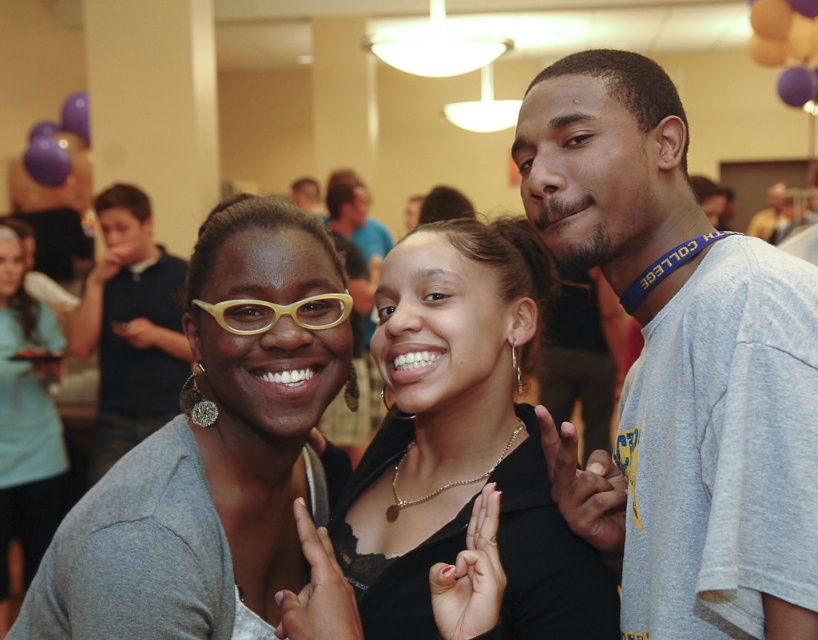
Question: Is matte black shirt at left wider than matte gray sweater at center?

Choices:
 (A) no
 (B) yes

Answer: (B)

Question: Is matte black shirt at left below matte gray sweater at center?

Choices:
 (A) yes
 (B) no

Answer: (B)

Question: Does matte black shirt at center come behind matte yellow glasses at center?

Choices:
 (A) no
 (B) yes

Answer: (A)

Question: Which point appears farthest from the camera in this image?

Choices:
 (A) (79, 516)
 (B) (3, 484)

Answer: (B)

Question: Which point is farther to the camera?

Choices:
 (A) (9, 378)
 (B) (321, 317)

Answer: (A)

Question: Among these objects, which one is nearest to the camera?

Choices:
 (A) matte gray sweater at center
 (B) matte black shirt at center
 (C) matte white glasses at left

Answer: (B)